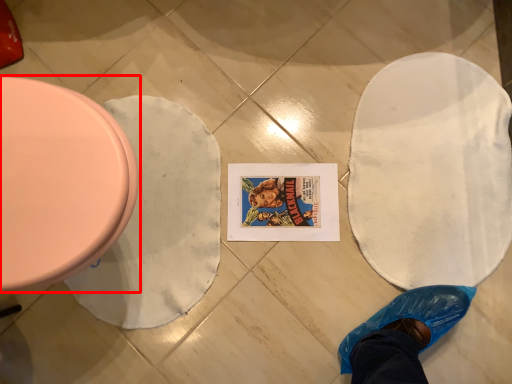
Question: From the image's perspective, what is the correct spatial positioning of toilet (annotated by the red box) in reference to blanket?

Choices:
 (A) above
 (B) below

Answer: (A)